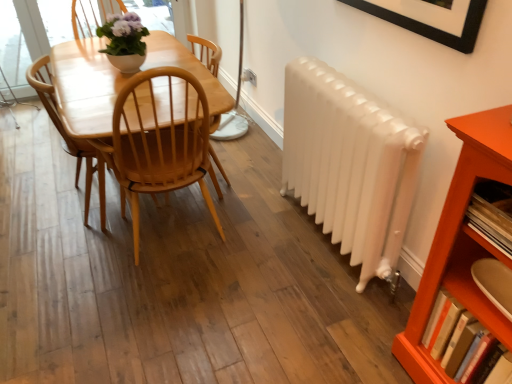
In order to click on free space to the left of light brown wood chair at center in this screenshot , I will do `click(40, 202)`.